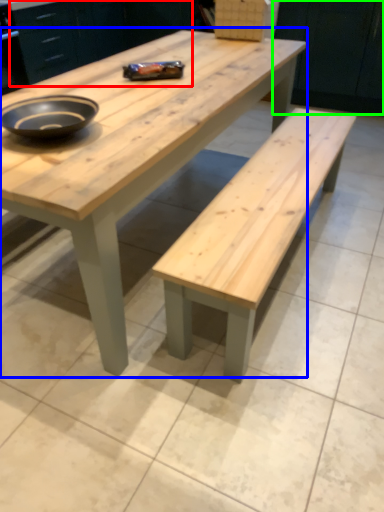
Question: Based on their relative distances, which object is nearer to cabinetry (highlighted by a red box)? Choose from coffee table (highlighted by a blue box) and cabinetry (highlighted by a green box).

Choices:
 (A) coffee table
 (B) cabinetry

Answer: (B)